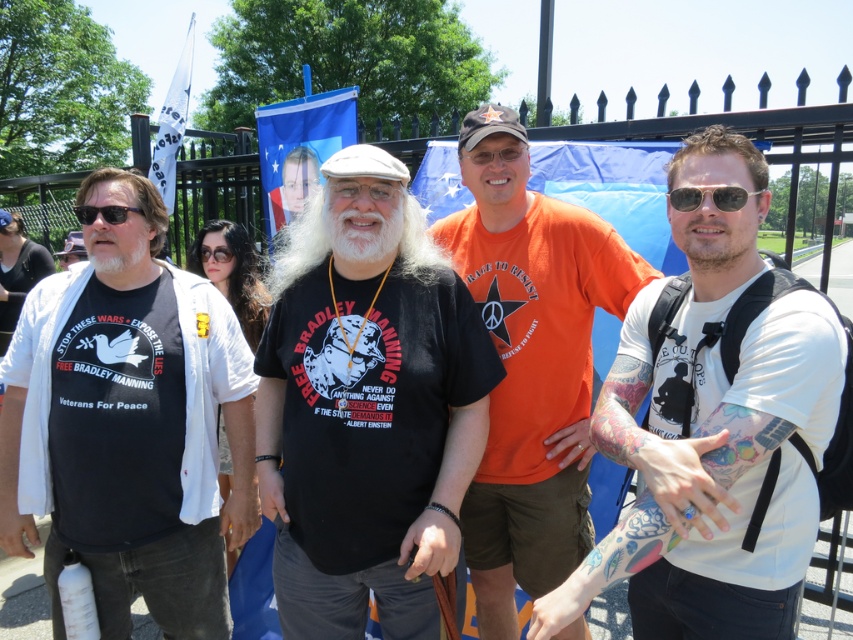
Where is `orange cotton t-shirt at center`? Image resolution: width=853 pixels, height=640 pixels. orange cotton t-shirt at center is located at coordinates (531, 365).

The width and height of the screenshot is (853, 640). What do you see at coordinates (531, 365) in the screenshot?
I see `orange cotton t-shirt at center` at bounding box center [531, 365].

Identify the location of orange cotton t-shirt at center. Image resolution: width=853 pixels, height=640 pixels. (531, 365).

Between brown matte beard at center and shiny black sunglasses at right, which one appears on the right side from the viewer's perspective?

From the viewer's perspective, brown matte beard at center appears more on the right side.

Locate an element on the screen. The image size is (853, 640). brown matte beard at center is located at coordinates pos(717,241).

Between point (737, 243) and point (682, 198), which one is positioned behind?

The point (682, 198) is more distant.

The height and width of the screenshot is (640, 853). I want to click on brown matte beard at center, so click(717, 241).

Who is higher up, black matte t-shirt at left or white matte t-shirt at right?

white matte t-shirt at right

Between point (158, 321) and point (740, 392), which one is positioned in front?

Point (740, 392) is in front.

Identify the location of black matte t-shirt at left. pyautogui.click(x=128, y=426).